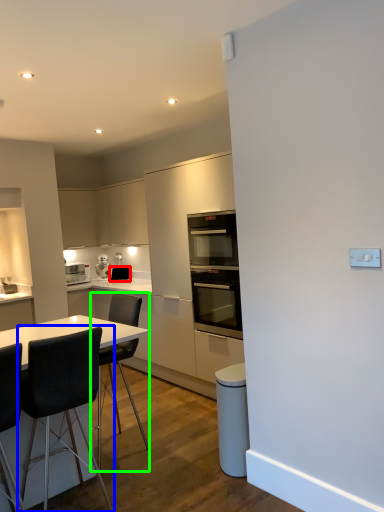
Question: Estimate the real-world distances between objects in this image. Which object is closer to appliance (highlighted by a red box), chair (highlighted by a blue box) or chair (highlighted by a green box)?

Choices:
 (A) chair
 (B) chair

Answer: (B)